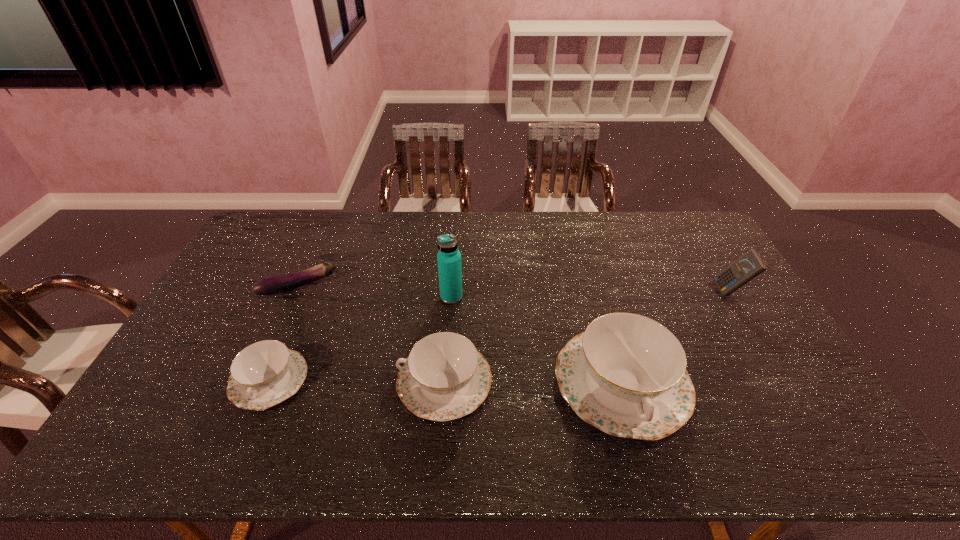
The height and width of the screenshot is (540, 960). In order to click on vacant area that lies between the second tallest chinaware and the eggplant in this screenshot , I will do `click(372, 334)`.

Where is `vacant point located between the rightmost object and the shortest object`? vacant point located between the rightmost object and the shortest object is located at coordinates click(515, 289).

The width and height of the screenshot is (960, 540). Identify the location of object that is the fifth closest to the eggplant. [x=750, y=265].

Where is `object that ranks as the second closest to the water bottle`? The image size is (960, 540). object that ranks as the second closest to the water bottle is located at coordinates (626, 375).

Locate which chinaware is the second closest to the shortest object. Please provide its 2D coordinates. Your answer should be formatted as a tuple, i.e. [(x, y)], where the tuple contains the x and y coordinates of a point satisfying the conditions above.

[(444, 377)]

Locate which chinaware ranks in proximity to the fifth object from left to right. Please provide its 2D coordinates. Your answer should be formatted as a tuple, i.e. [(x, y)], where the tuple contains the x and y coordinates of a point satisfying the conditions above.

[(444, 377)]